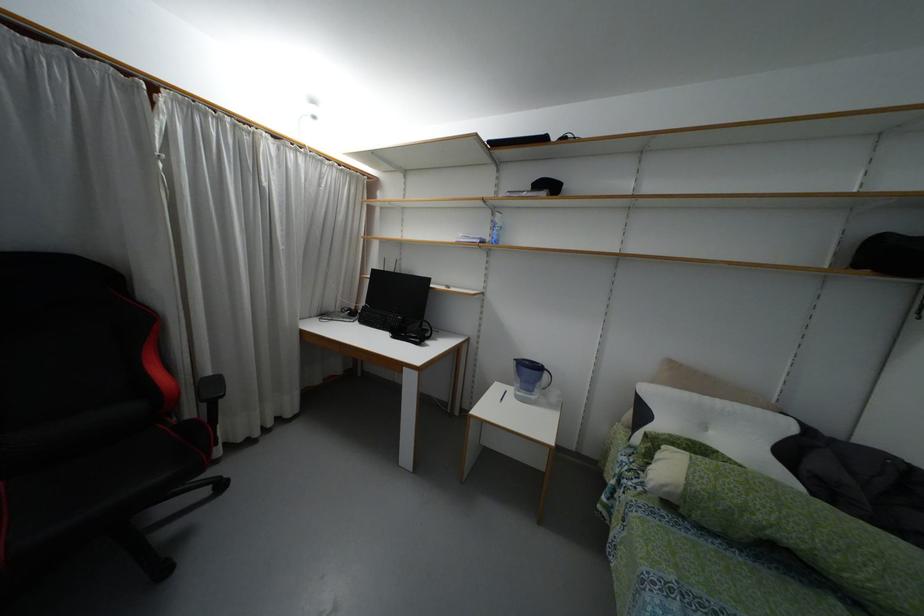
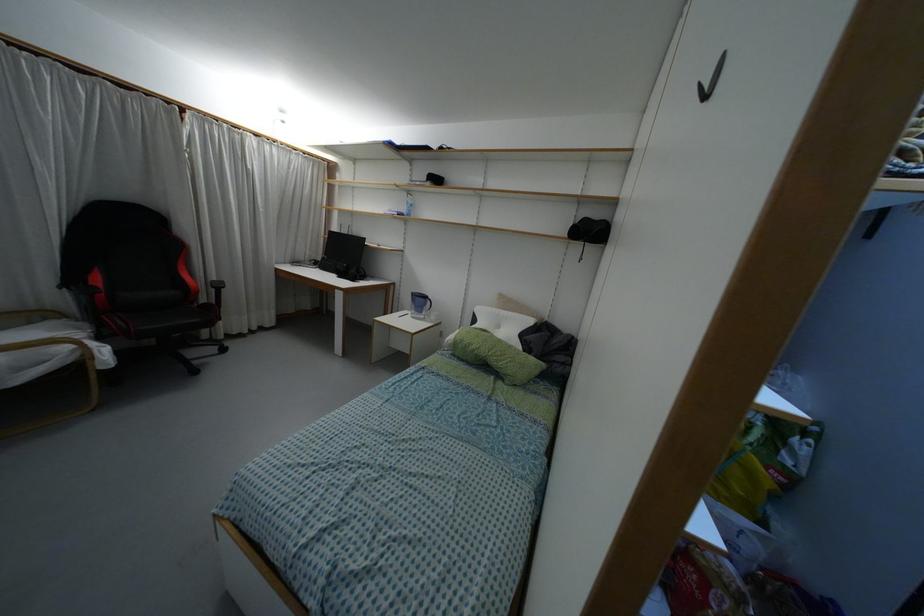
Find the pixel in the second image that matches pixel 695 395 in the first image.

(496, 310)